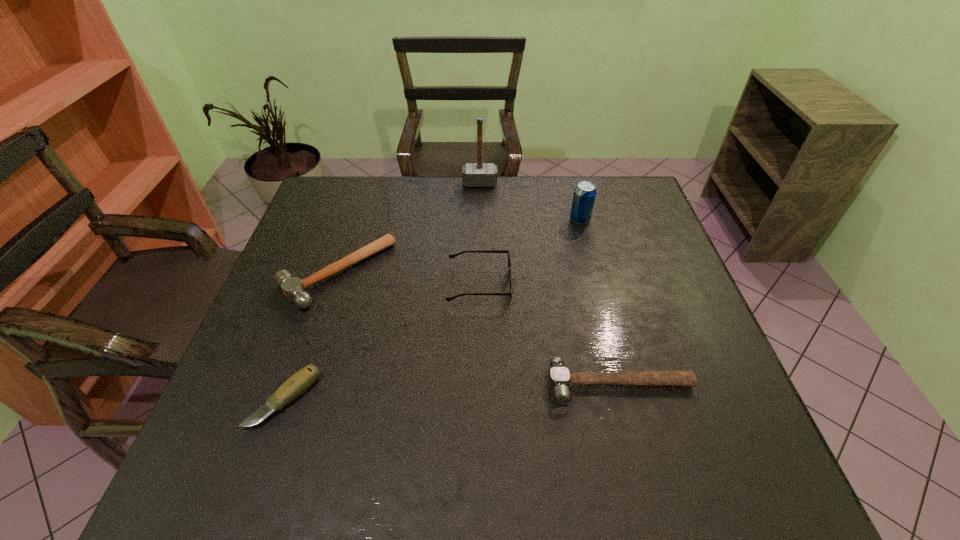
The height and width of the screenshot is (540, 960). I want to click on empty space between the second farthest object and the leftmost hammer, so click(459, 246).

Identify the location of vacant region between the leftmost hammer and the fourth shortest object. The image size is (960, 540). (408, 279).

Locate an element on the screen. The width and height of the screenshot is (960, 540). free point between the farthest object and the shortest object is located at coordinates (382, 291).

This screenshot has height=540, width=960. Find the location of `unoccupied area between the fifth shortest object and the second farthest hammer`. unoccupied area between the fifth shortest object and the second farthest hammer is located at coordinates (459, 246).

I want to click on empty space between the tallest hammer and the second tallest object, so click(530, 201).

Where is `free point between the nearest hammer and the beer can`? Image resolution: width=960 pixels, height=540 pixels. free point between the nearest hammer and the beer can is located at coordinates (600, 302).

Where is `object identified as the closest to the rightmost hammer`? The height and width of the screenshot is (540, 960). object identified as the closest to the rightmost hammer is located at coordinates (451, 256).

Identify which object is the fourth closest to the farthest hammer. Please provide its 2D coordinates. Your answer should be formatted as a tuple, i.e. [(x, y)], where the tuple contains the x and y coordinates of a point satisfying the conditions above.

[(559, 376)]

Locate which hammer ranks in proximity to the tallest object. Please provide its 2D coordinates. Your answer should be formatted as a tuple, i.e. [(x, y)], where the tuple contains the x and y coordinates of a point satisfying the conditions above.

[(293, 288)]

Select which hammer appears as the second closest to the pocketknife. Please provide its 2D coordinates. Your answer should be formatted as a tuple, i.e. [(x, y)], where the tuple contains the x and y coordinates of a point satisfying the conditions above.

[(559, 376)]